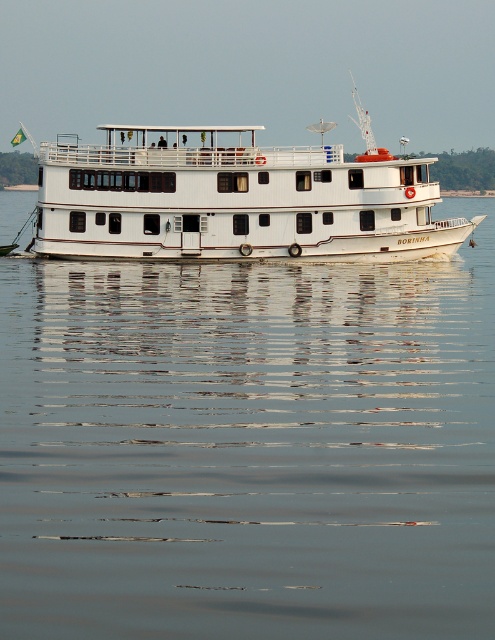
Can you confirm if smooth white water at center is taller than white matte boat at center?

Incorrect, smooth white water at center's height is not larger of white matte boat at center's.

From the picture: Can you confirm if smooth white water at center is positioned above white matte boat at center?

No.

Does point (126, 308) come closer to viewer compared to point (95, 161)?

Yes.

Identify the location of smooth white water at center. (248, 448).